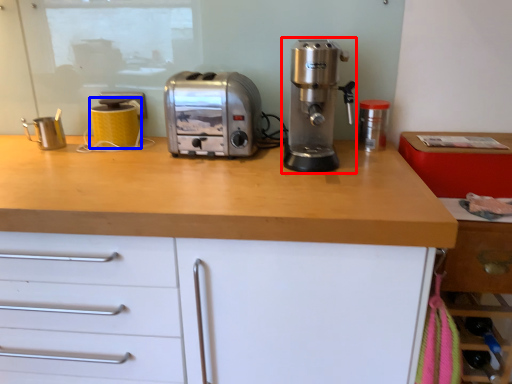
Question: Which point is closer to the camera, coffee machine (highlighted by a red box) or kitchen appliance (highlighted by a blue box)?

Choices:
 (A) coffee machine
 (B) kitchen appliance

Answer: (A)